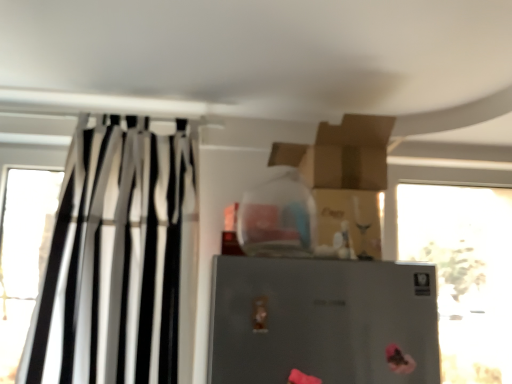
Question: From a real-world perspective, is black/white striped curtain at left beneath satin silver refrigerator at center?

Choices:
 (A) no
 (B) yes

Answer: (A)

Question: Is satin silver refrigerator at center at the back of black/white striped curtain at left?

Choices:
 (A) yes
 (B) no

Answer: (B)

Question: Is the position of black/white striped curtain at left less distant than that of satin silver refrigerator at center?

Choices:
 (A) no
 (B) yes

Answer: (A)

Question: Does black/white striped curtain at left have a lesser width compared to satin silver refrigerator at center?

Choices:
 (A) no
 (B) yes

Answer: (A)

Question: Is the position of black/white striped curtain at left more distant than that of satin silver refrigerator at center?

Choices:
 (A) no
 (B) yes

Answer: (B)

Question: Considering the positions of point (473, 266) and point (257, 246), is point (473, 266) closer or farther from the camera than point (257, 246)?

Choices:
 (A) closer
 (B) farther

Answer: (B)

Question: In the image, is transparent glass window at right positioned in front of or behind transparent glass bottle at upper center?

Choices:
 (A) front
 (B) behind

Answer: (B)

Question: From the image's perspective, is transparent glass window at right positioned above or below transparent glass bottle at upper center?

Choices:
 (A) above
 (B) below

Answer: (B)

Question: Which is correct: transparent glass window at right is inside transparent glass bottle at upper center, or outside of it?

Choices:
 (A) outside
 (B) inside

Answer: (A)

Question: Considering the relative positions of satin silver refrigerator at center and transparent glass bottle at upper center in the image provided, is satin silver refrigerator at center to the left or to the right of transparent glass bottle at upper center?

Choices:
 (A) left
 (B) right

Answer: (B)

Question: Is satin silver refrigerator at center inside or outside of transparent glass bottle at upper center?

Choices:
 (A) inside
 (B) outside

Answer: (B)

Question: From a real-world perspective, relative to transparent glass bottle at upper center, is satin silver refrigerator at center vertically above or below?

Choices:
 (A) below
 (B) above

Answer: (A)

Question: Is satin silver refrigerator at center bigger or smaller than transparent glass bottle at upper center?

Choices:
 (A) big
 (B) small

Answer: (B)

Question: Is transparent glass bottle at upper center wider or thinner than black/white striped curtain at left?

Choices:
 (A) wide
 (B) thin

Answer: (B)

Question: Visually, is transparent glass bottle at upper center positioned to the left or to the right of black/white striped curtain at left?

Choices:
 (A) left
 (B) right

Answer: (B)